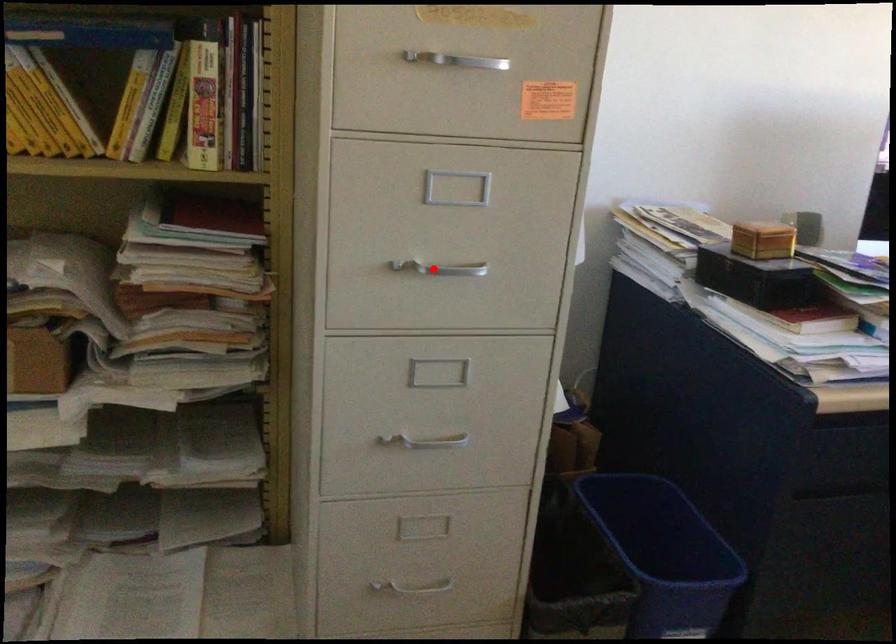
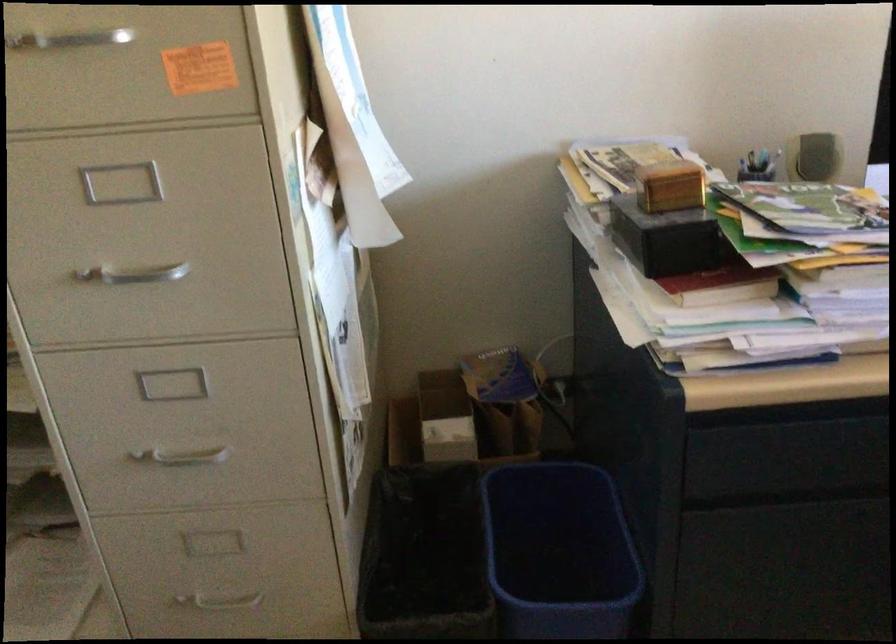
Question: I am providing you with two images of the same scene from different viewpoints. Image1 has a red point marked. In image2, the corresponding 3D location appears at what relative position? Reply with the corresponding letter.

Choices:
 (A) Closer
 (B) Farther

Answer: (A)